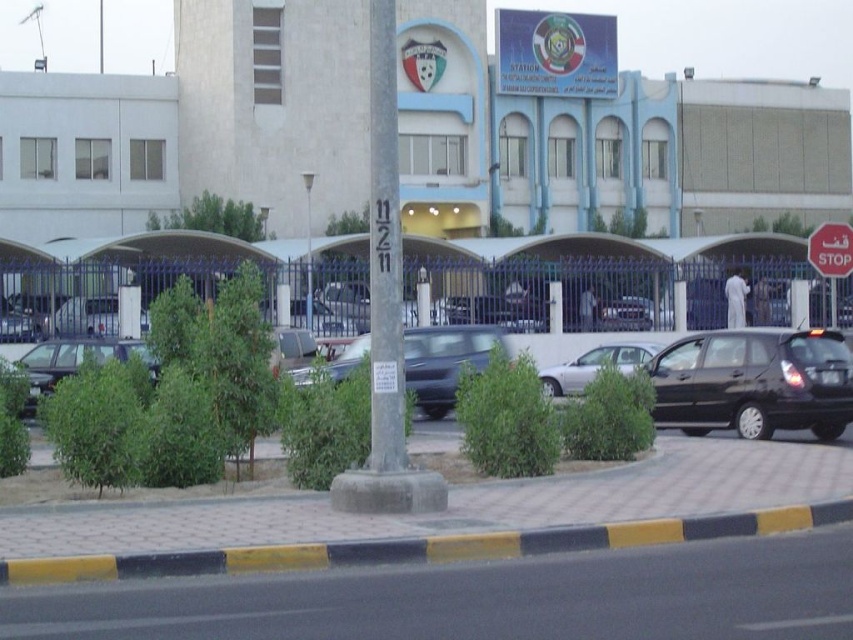
You are standing at the center of the parking area and want to locate two points marked in the image. The first point is at coordinates point [694,403] and the second is at point [844,234]. Which point is nearer to your current position?

Point [694,403] is closer to the camera than point [844,234], so the first point is nearer to your current position.

You are a pedestrian trying to cross the road in the image. You see the gray concrete pole at center and the red matte stop sign at upper right. Which object is higher from the ground?

The gray concrete pole at center is above the red matte stop sign at upper right, so the gray concrete pole at center is higher from the ground.

You are a delivery driver who needs to park your truck, which is 2 meters wide, in the parking area. There is a shiny black car at right and a red matte stop sign at upper right. Can you safely park your truck between these two objects without hitting either?

The shiny black car at right might be wider than the red matte stop sign at upper right. Since the truck is 2 meters wide, if the space between them is wider than 2 meters, it would be safe. However, the description only states a possibility about their widths, not the exact distance between them. Therefore, it is uncertain if the truck can safely park between them without hitting either.